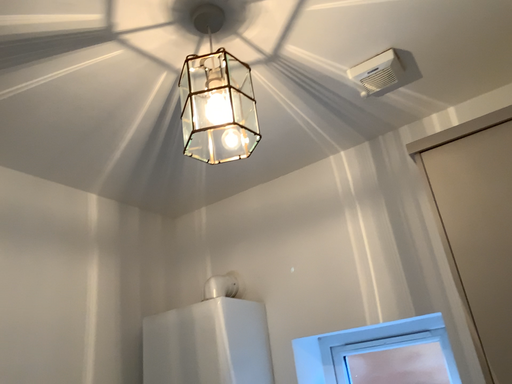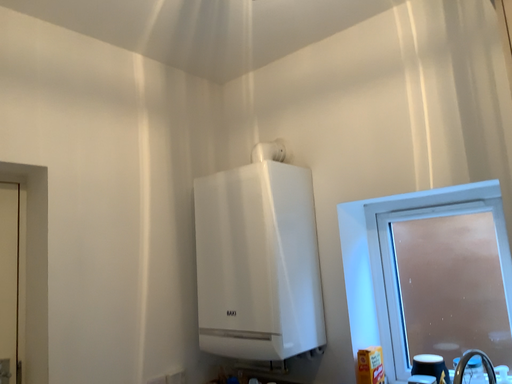
Question: How did the camera likely rotate when shooting the video?

Choices:
 (A) rotated left
 (B) rotated right

Answer: (A)